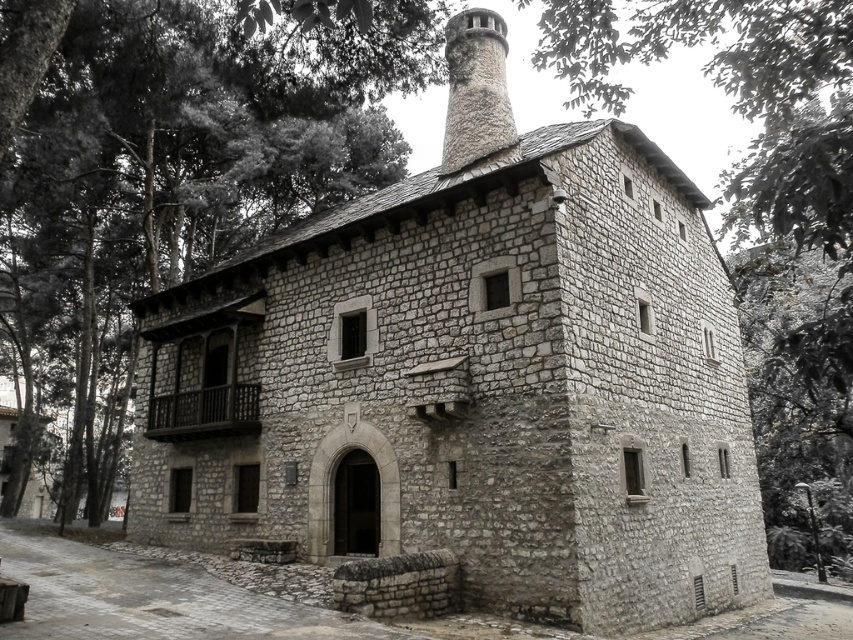
Question: Which point is farther to the camera?

Choices:
 (A) [x=305, y=45]
 (B) [x=482, y=145]

Answer: (B)

Question: Is green leafy tree at upper left below rough stone chimney at upper center?

Choices:
 (A) yes
 (B) no

Answer: (A)

Question: Among these objects, which one is nearest to the camera?

Choices:
 (A) rough stone chimney at upper center
 (B) green leafy tree at upper left

Answer: (B)

Question: Does green leafy tree at upper left have a smaller size compared to rough stone chimney at upper center?

Choices:
 (A) no
 (B) yes

Answer: (A)

Question: Is green leafy tree at upper left smaller than rough stone chimney at upper center?

Choices:
 (A) no
 (B) yes

Answer: (A)